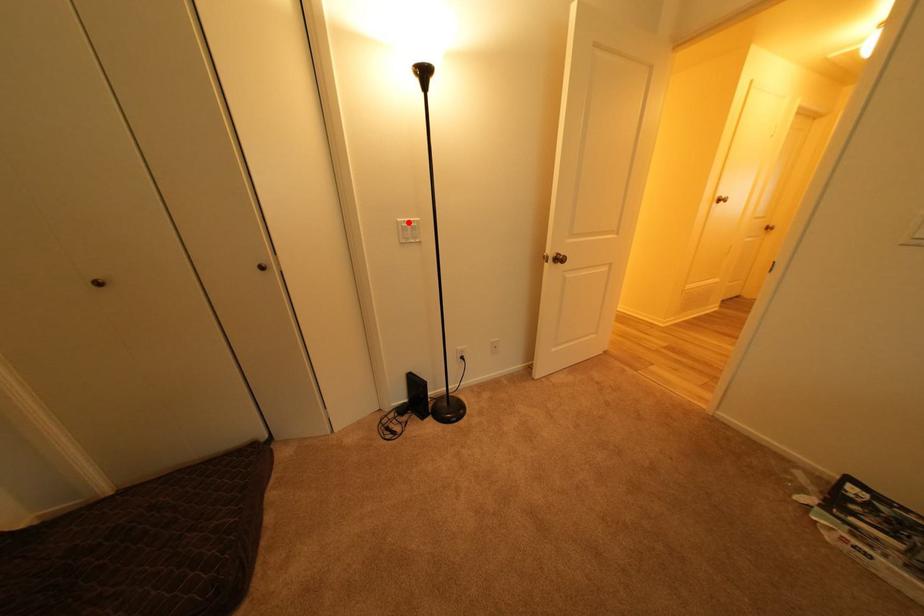
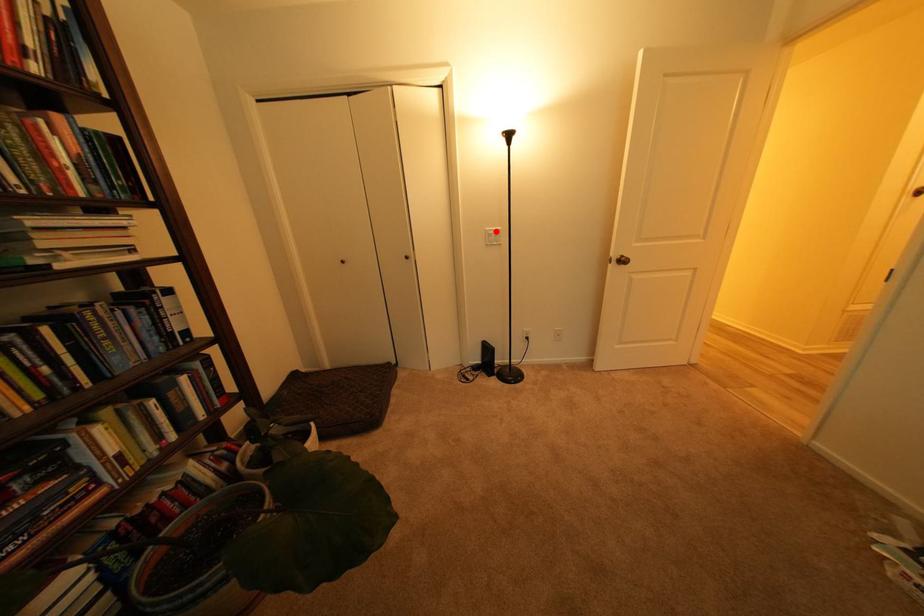
I am providing you with two images of the same scene from different viewpoints. A red point is marked on the first image and another point is marked on the second image. Does the point marked in image1 correspond to the same location as the one in image2?

Yes